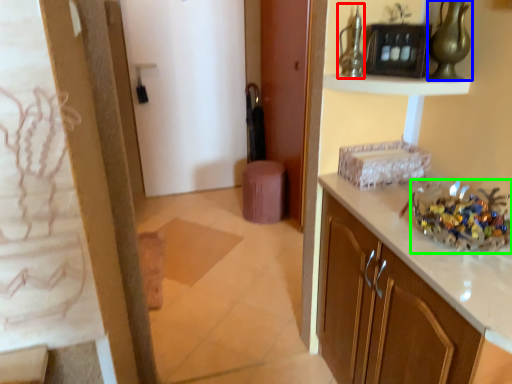
Question: Which is farther away from glass vase (highlighted by a red box)? glass vase (highlighted by a blue box) or floral arrangement (highlighted by a green box)?

Choices:
 (A) glass vase
 (B) floral arrangement

Answer: (B)